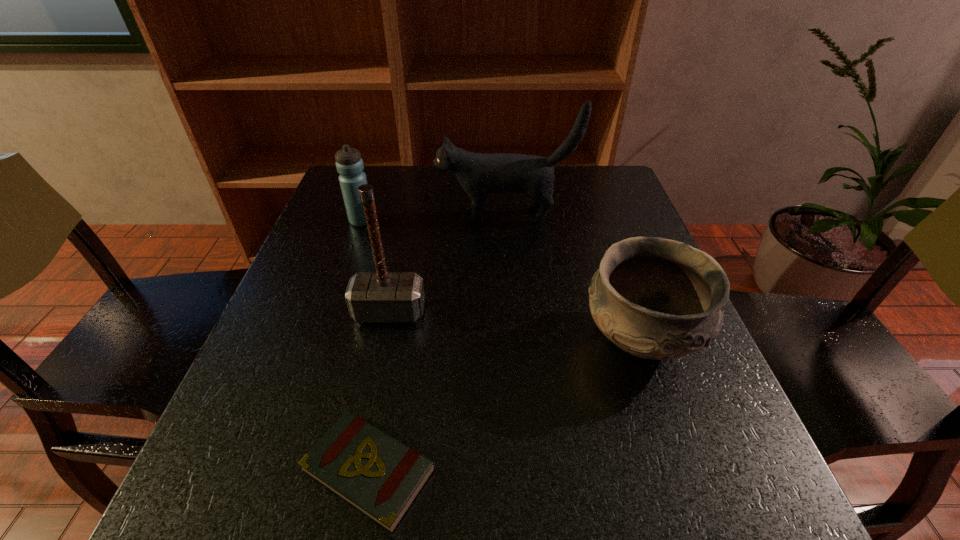
At what (x,y) coordinates should I click in order to perform the action: click on object present at the near left corner. Please return your answer as a coordinate pair (x, y). This screenshot has width=960, height=540. Looking at the image, I should click on coord(379,476).

The width and height of the screenshot is (960, 540). I want to click on vacant space at the far edge of the desktop, so click(x=410, y=201).

Locate an element on the screen. The width and height of the screenshot is (960, 540). free point at the left edge is located at coordinates (341, 221).

In the image, there is a desktop. Where is `vacant area at the right edge`? This screenshot has height=540, width=960. vacant area at the right edge is located at coordinates (708, 454).

Identify the location of free location at the far left corner of the desktop. This screenshot has height=540, width=960. (368, 176).

The width and height of the screenshot is (960, 540). Find the location of `vacant space at the far right corner of the desktop`. vacant space at the far right corner of the desktop is located at coordinates (615, 167).

Locate an element on the screen. This screenshot has height=540, width=960. free space between the second shortest object and the cat is located at coordinates (573, 278).

Locate an element on the screen. free space between the third shortest object and the pottery is located at coordinates (501, 280).

This screenshot has height=540, width=960. What are the coordinates of `vacant area that lies between the second shortest object and the cat` in the screenshot? It's located at (573, 278).

Locate an element on the screen. The width and height of the screenshot is (960, 540). empty space between the nearest object and the hammer is located at coordinates (379, 391).